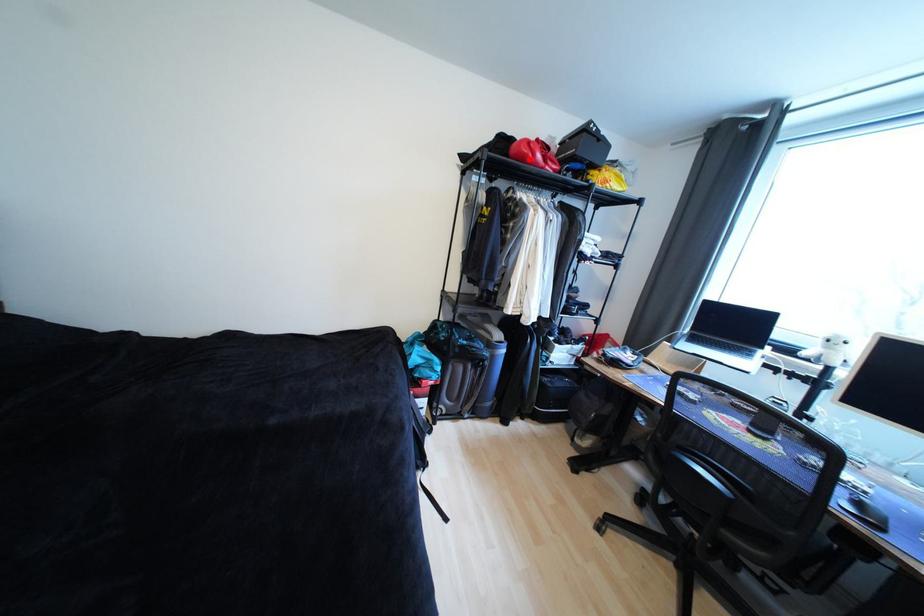
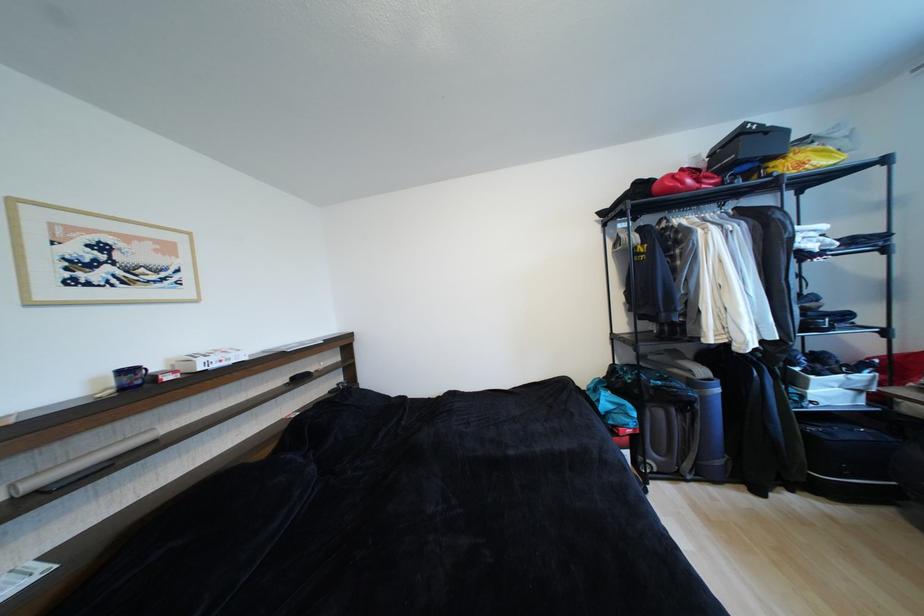
Locate, in the second image, the point that corresponds to the highlighted location in the first image.

(676, 192)